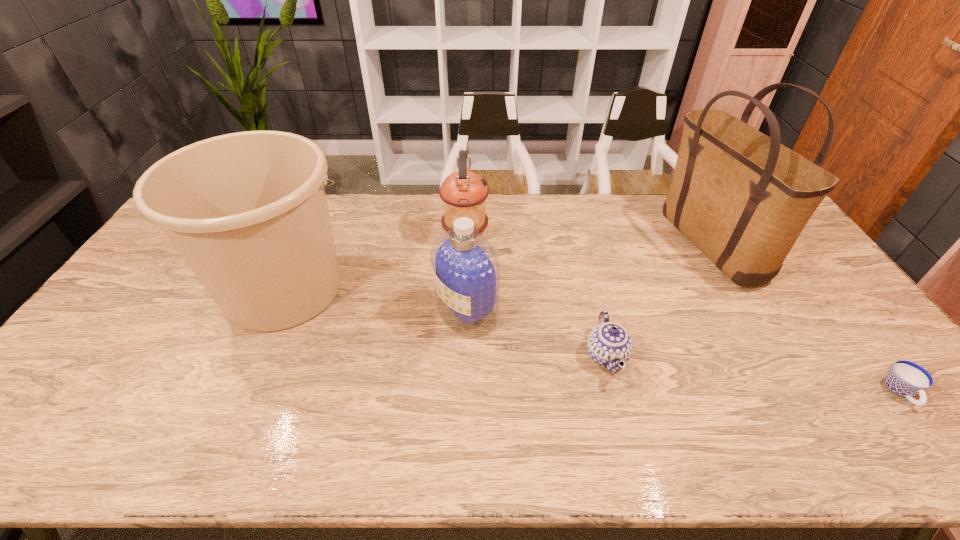
The height and width of the screenshot is (540, 960). I want to click on tote bag, so click(x=742, y=198).

The image size is (960, 540). I want to click on the fifth object from left to right, so click(742, 198).

The image size is (960, 540). I want to click on the leftmost object, so click(x=247, y=211).

Locate an element on the screen. Image resolution: width=960 pixels, height=540 pixels. the fifth shortest object is located at coordinates (247, 211).

I want to click on cleansing agent, so click(x=466, y=270).

Identify the location of oil lamp. [x=464, y=193].

The image size is (960, 540). I want to click on the third object from right to left, so click(x=609, y=345).

At what (x,y) coordinates should I click in order to perform the action: click on chinaware. Please return your answer as a coordinate pair (x, y). Looking at the image, I should click on (609, 345).

Image resolution: width=960 pixels, height=540 pixels. What are the coordinates of `the rightmost object` in the screenshot? It's located at (904, 378).

In order to click on the shortest object in this screenshot , I will do `click(904, 378)`.